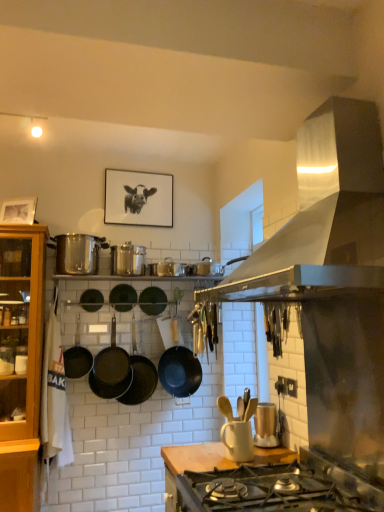
Question: Does wooden at center have a smaller size compared to black matte wok at center, the 2th wok from the right?

Choices:
 (A) no
 (B) yes

Answer: (A)

Question: Is wooden at center positioned far away from black matte wok at center, the 2th wok from the right?

Choices:
 (A) no
 (B) yes

Answer: (B)

Question: Does wooden at center have a lesser height compared to black matte wok at center, which ranks as the 6th wok in left-to-right order?

Choices:
 (A) no
 (B) yes

Answer: (A)

Question: Is wooden at center oriented away from black matte wok at center, which ranks as the 6th wok in left-to-right order?

Choices:
 (A) yes
 (B) no

Answer: (B)

Question: Is wooden at center aimed at black matte wok at center, which ranks as the 6th wok in left-to-right order?

Choices:
 (A) yes
 (B) no

Answer: (B)

Question: From the image's perspective, is wooden at center located above black matte wok at center, which ranks as the 6th wok in left-to-right order?

Choices:
 (A) no
 (B) yes

Answer: (A)

Question: Can you confirm if black matte wok at center, the seventh wok when ordered from left to right, is smaller than satin silver range hood at upper right?

Choices:
 (A) no
 (B) yes

Answer: (B)

Question: Considering the relative positions of black matte wok at center, which is the 1th wok in right-to-left order, and satin silver range hood at upper right in the image provided, is black matte wok at center, which is the 1th wok in right-to-left order, to the right of satin silver range hood at upper right from the viewer's perspective?

Choices:
 (A) no
 (B) yes

Answer: (A)

Question: Is black matte wok at center, which is the 1th wok in right-to-left order, further to the viewer compared to satin silver range hood at upper right?

Choices:
 (A) yes
 (B) no

Answer: (A)

Question: From a real-world perspective, is black matte wok at center, the seventh wok when ordered from left to right, on satin silver range hood at upper right?

Choices:
 (A) yes
 (B) no

Answer: (B)

Question: Considering the relative sizes of black matte wok at center, the seventh wok when ordered from left to right, and satin silver range hood at upper right in the image provided, is black matte wok at center, the seventh wok when ordered from left to right, wider than satin silver range hood at upper right?

Choices:
 (A) no
 (B) yes

Answer: (A)

Question: Could you tell me if black matte wok at center, the seventh wok when ordered from left to right, is facing satin silver range hood at upper right?

Choices:
 (A) yes
 (B) no

Answer: (A)

Question: Would you consider green matte wok at center, the fourth wok viewed from the right, to be distant from matte gold toaster at center, which is the first appliance in right-to-left order?

Choices:
 (A) no
 (B) yes

Answer: (B)